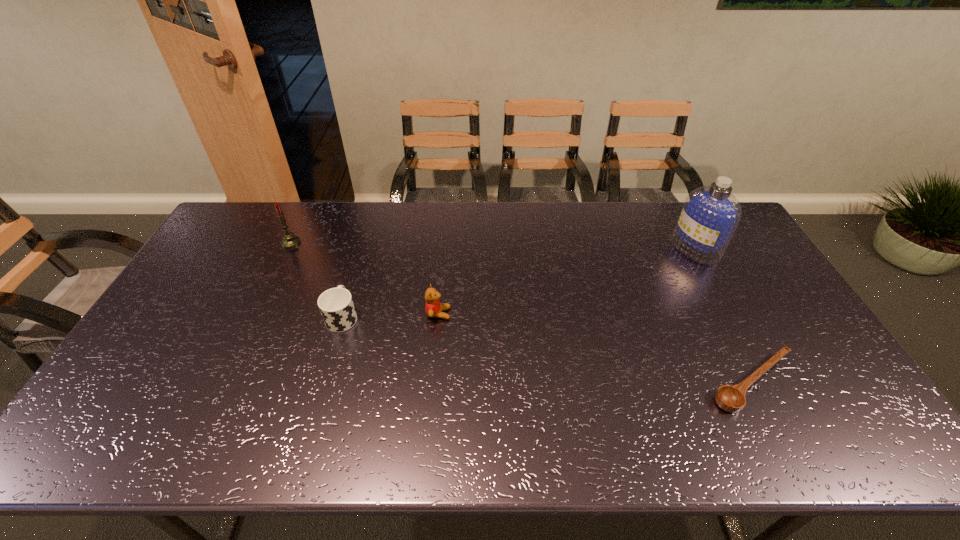
This screenshot has height=540, width=960. What are the coordinates of `vacant space located 0.230m on the right of the second tallest object` in the screenshot? It's located at (366, 242).

I want to click on free space located on the front-facing side of the third shortest object, so click(x=492, y=314).

Where is `free space located 0.180m on the side of the cup with the handle`? free space located 0.180m on the side of the cup with the handle is located at coordinates (359, 261).

At what (x,y) coordinates should I click in order to perform the action: click on free region located on the side of the cup with the handle. Please return your answer as a coordinate pair (x, y). Looking at the image, I should click on (360, 258).

Locate an element on the screen. The height and width of the screenshot is (540, 960). free space located 0.070m on the side of the cup with the handle is located at coordinates (352, 285).

At what (x,y) coordinates should I click in order to perform the action: click on free point located on the left of the nearest object. Please return your answer as a coordinate pair (x, y). The image size is (960, 540). Looking at the image, I should click on (620, 382).

Find the location of a particular element. cleansing agent present at the far edge is located at coordinates (710, 214).

Where is `candle that is at the far edge`? candle that is at the far edge is located at coordinates (289, 240).

At what (x,y) coordinates should I click in order to perform the action: click on cleansing agent that is positioned at the right edge. Please return your answer as a coordinate pair (x, y). Looking at the image, I should click on (710, 214).

Find the location of a particular element. wooden spoon that is at the right edge is located at coordinates (732, 399).